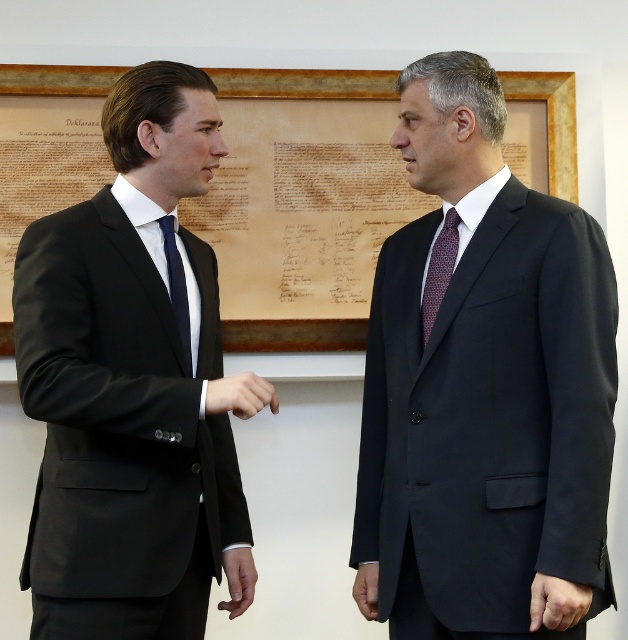
Question: Which point appears farthest from the camera in this image?

Choices:
 (A) click(x=371, y=612)
 (B) click(x=224, y=572)
 (C) click(x=4, y=320)
 (D) click(x=171, y=241)

Answer: (C)

Question: Considering the real-world distances, which object is closest to the matte black suit at right?

Choices:
 (A) black smooth hand at center
 (B) navy silk tie at left

Answer: (A)

Question: Does matte black suit at right come behind dark red textured tie at center?

Choices:
 (A) no
 (B) yes

Answer: (A)

Question: Does matte black suit at right appear on the left side of black smooth suit at lower left?

Choices:
 (A) no
 (B) yes

Answer: (A)

Question: Which of the following is the farthest from the observer?

Choices:
 (A) matte black suit at right
 (B) matte black suit at center
 (C) navy silk tie at left
 (D) dark red textured tie at center

Answer: (D)

Question: Does matte black suit at right appear on the left side of black smooth hand at center?

Choices:
 (A) yes
 (B) no

Answer: (B)